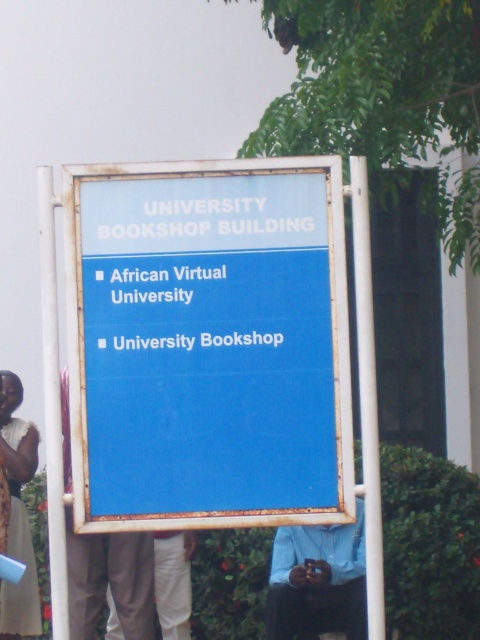
Question: Which point is closer to the camera?

Choices:
 (A) blue shirt at center
 (B) blue matte sign at center
 (C) light brown pants at lower left
 (D) white lace dress at lower left

Answer: (B)

Question: Which of the following is the closest to the observer?

Choices:
 (A) blue shirt at center
 (B) white lace dress at lower left

Answer: (A)

Question: In this image, where is blue matte sign at center located relative to light brown pants at lower left?

Choices:
 (A) right
 (B) left

Answer: (A)

Question: Can you confirm if blue matte sign at center is bigger than blue shirt at center?

Choices:
 (A) no
 (B) yes

Answer: (A)

Question: Which object is the farthest from the blue matte sign at center?

Choices:
 (A) white lace dress at lower left
 (B) light brown pants at lower left
 (C) blue shirt at center

Answer: (A)

Question: Is blue shirt at center above white lace dress at lower left?

Choices:
 (A) no
 (B) yes

Answer: (A)